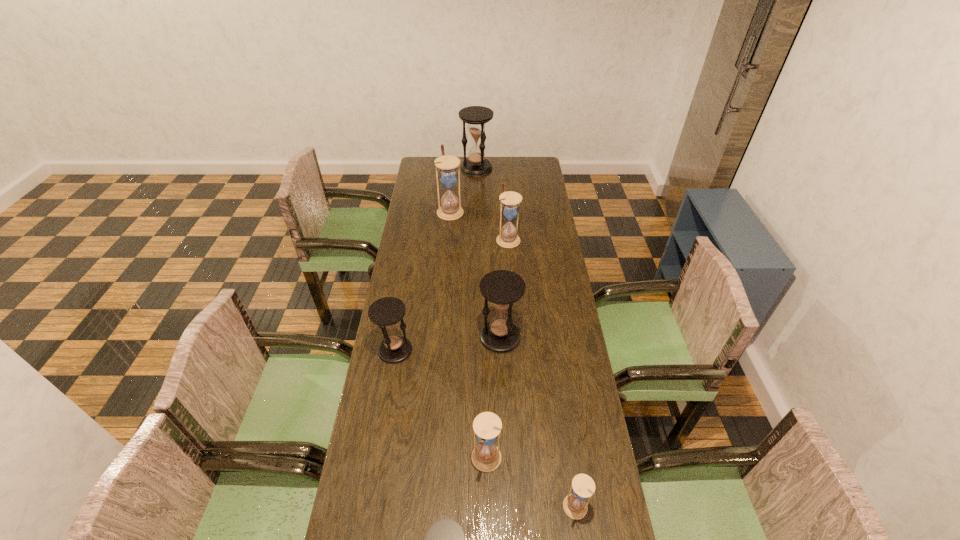
At what (x,y) coordinates should I click in order to perform the action: click on the third farthest white hourglass. Please return your answer as a coordinate pair (x, y). This screenshot has height=540, width=960. Looking at the image, I should click on (486, 456).

This screenshot has height=540, width=960. Find the location of `the rightmost white hourglass`. the rightmost white hourglass is located at coordinates (583, 487).

Image resolution: width=960 pixels, height=540 pixels. Find the location of `the rightmost hourglass`. the rightmost hourglass is located at coordinates (583, 487).

Locate an element on the screen. vacant region located on the right of the biggest black hourglass is located at coordinates (512, 168).

You are a GUI agent. You are given a task and a screenshot of the screen. Output one action in this format:
    pyautogui.click(x=<x>, y=<y>)
    Task: Click on the vacant space located on the front of the second farthest hourglass
    This screenshot has width=960, height=540.
    Given the screenshot: What is the action you would take?
    pyautogui.click(x=447, y=251)

At what (x,y) coordinates should I click in order to perform the action: click on vacant area located 0.190m on the front of the second white hourglass from right to left. Please return your answer as a coordinate pair (x, y). The image size is (960, 540). Looking at the image, I should click on (511, 276).

Where is `vacant region located on the front of the third smallest black hourglass`? vacant region located on the front of the third smallest black hourglass is located at coordinates (504, 423).

Locate an element on the screen. This screenshot has width=960, height=540. free space located on the front of the leftmost hourglass is located at coordinates [x=382, y=425].

What are the coordinates of `free space located 0.320m on the back of the third biggest white hourglass` in the screenshot? It's located at (486, 357).

At what (x,y) coordinates should I click in order to perform the action: click on vacant space situated on the back of the second nearest hourglass. Please return your answer as a coordinate pair (x, y). The height and width of the screenshot is (540, 960). Looking at the image, I should click on (558, 389).